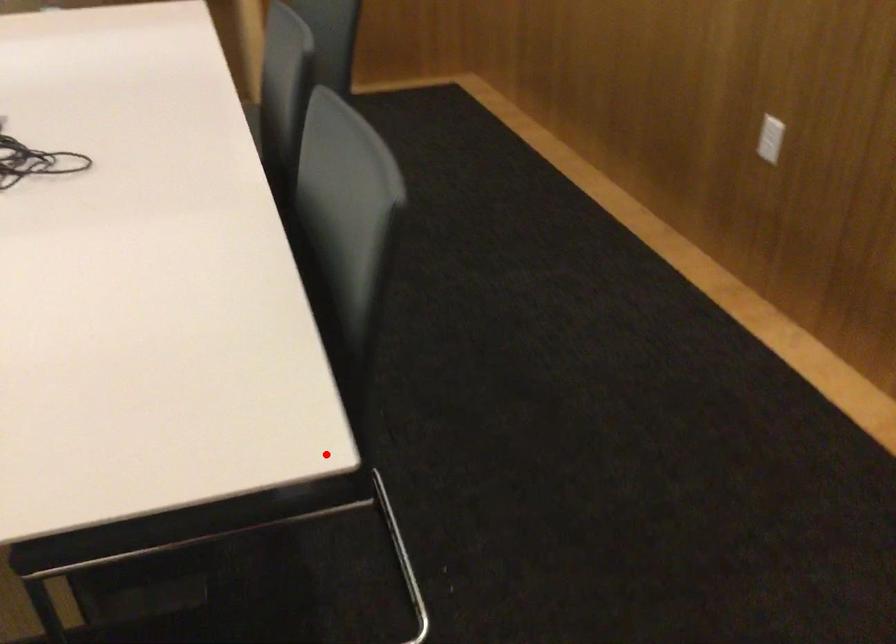
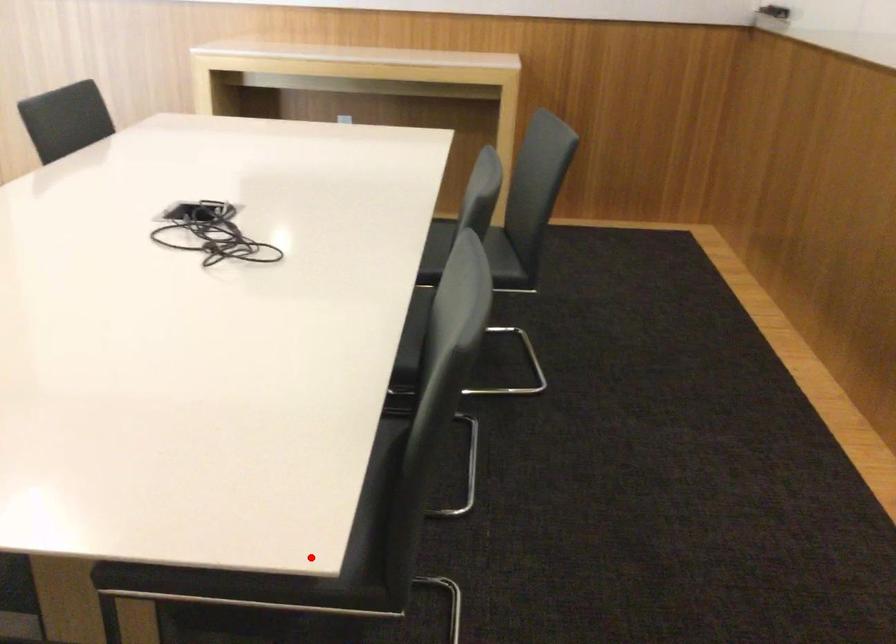
I am providing you with two images of the same scene from different viewpoints. A red point is marked on the first image and another point is marked on the second image. Are the points marked in image1 and image2 representing the same 3D position?

Yes